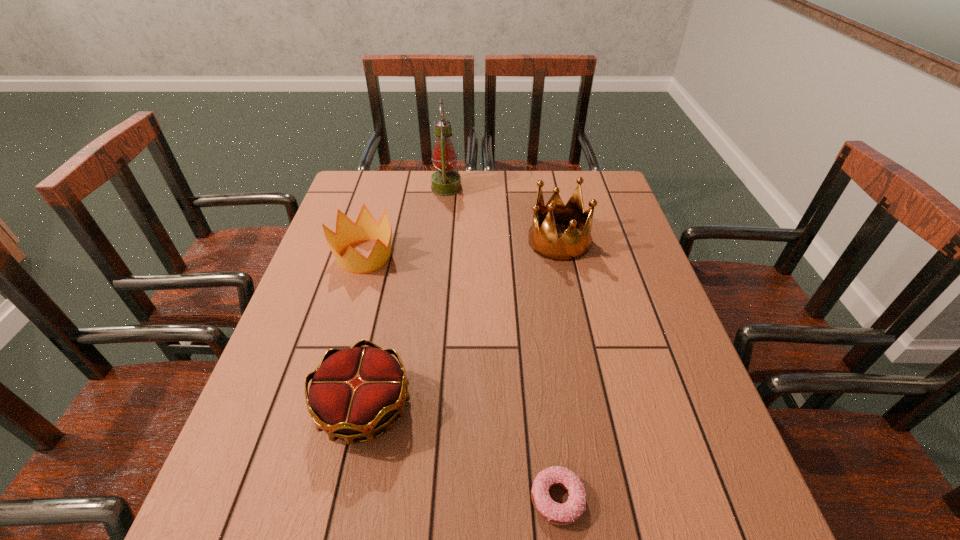
Where is `blank region between the second nearest object and the farthest object`? This screenshot has width=960, height=540. blank region between the second nearest object and the farthest object is located at coordinates (405, 298).

This screenshot has height=540, width=960. Identify the location of free spot between the nearest crown and the shortest object. (461, 453).

This screenshot has width=960, height=540. I want to click on free area in between the shortest object and the fourth farthest object, so click(x=461, y=453).

You are a GUI agent. You are given a task and a screenshot of the screen. Output one action in this format:
    pyautogui.click(x=<x>, y=<y>)
    Task: Click on the vacant area that lies between the nearest object and the farthest object
    Image resolution: width=960 pixels, height=540 pixels.
    Given the screenshot: What is the action you would take?
    point(502,343)

Find the location of a particular element. unoccupied area between the tallest object and the doughnut is located at coordinates (502, 343).

Identify which object is located as the fourth nearest to the shortest object. Please provide its 2D coordinates. Your answer should be formatted as a tuple, i.e. [(x, y)], where the tuple contains the x and y coordinates of a point satisfying the conditions above.

[(445, 182)]

Locate an element on the screen. This screenshot has height=540, width=960. object that ranks as the second closest to the tallest object is located at coordinates (544, 241).

Identify the location of crown that is the nearest to the fourth farthest object. The height and width of the screenshot is (540, 960). tap(365, 228).

Image resolution: width=960 pixels, height=540 pixels. I want to click on crown that is the third closest to the farthest object, so [x=355, y=392].